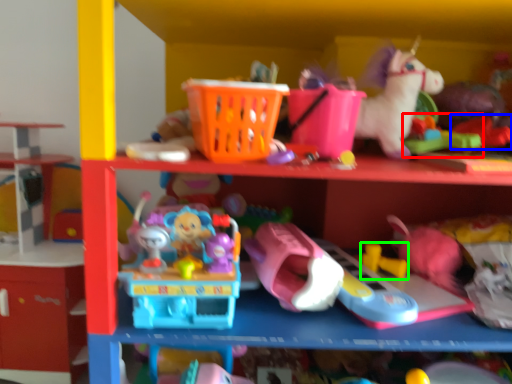
Question: Which object is the farthest from toy (highlighted by a red box)? Choose among these: toy (highlighted by a blue box) or toy (highlighted by a green box).

Choices:
 (A) toy
 (B) toy

Answer: (B)